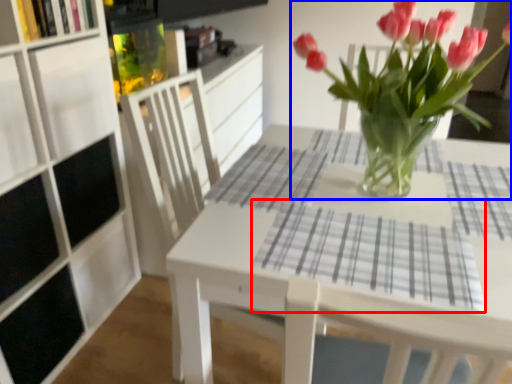
Question: Among these objects, which one is nearest to the camera, flannel (highlighted by a red box) or houseplant (highlighted by a blue box)?

Choices:
 (A) flannel
 (B) houseplant

Answer: (B)